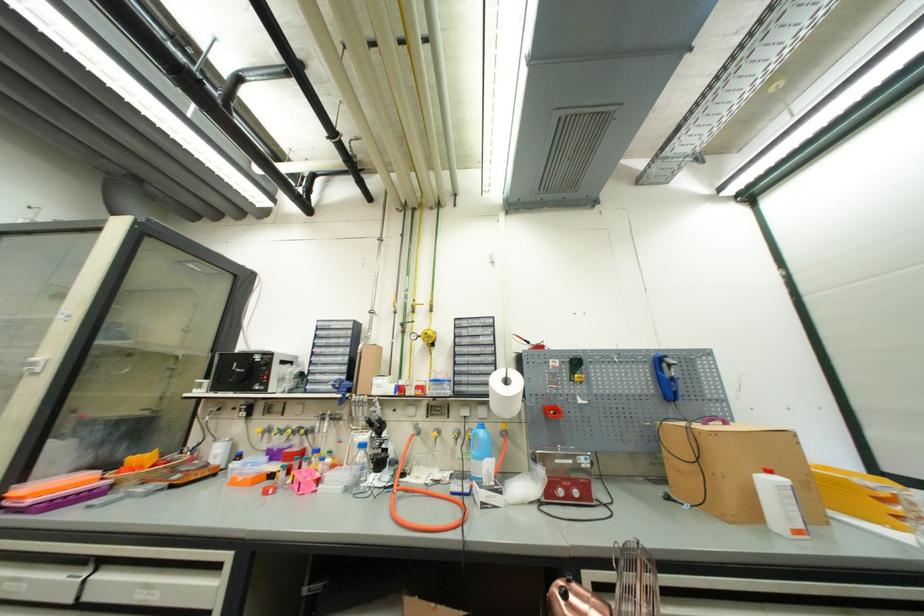
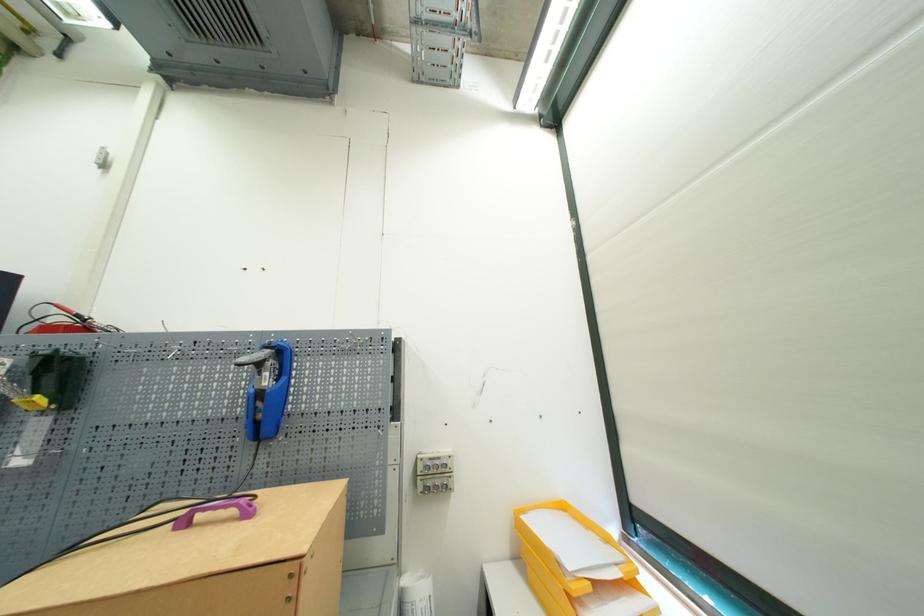
The images are taken continuously from a first-person perspective. In which direction are you moving?

The movement direction of the cameraman is right, forward.